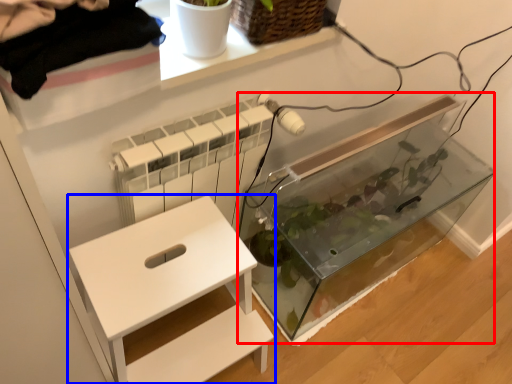
Question: Which of the following is the farthest to the observer, glass box (highlighted by a red box) or furniture (highlighted by a blue box)?

Choices:
 (A) glass box
 (B) furniture

Answer: (A)